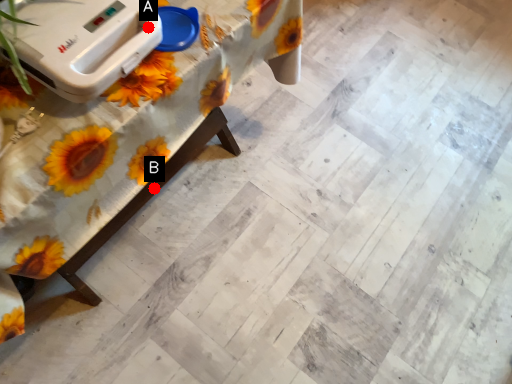
Question: Two points are circled on the image, labeled by A and B beside each circle. Which point is farther from the camera taking this photo?

Choices:
 (A) A is further
 (B) B is further

Answer: (B)